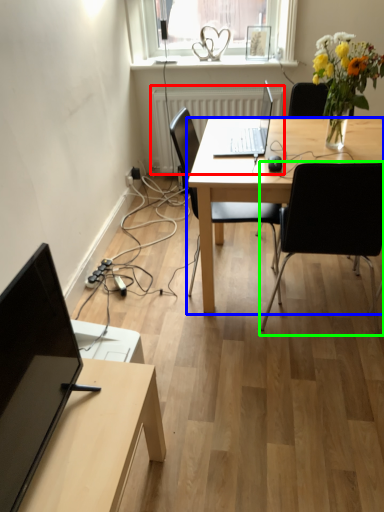
Question: Which object is positioned farthest from radiator (highlighted by a red box)? Select from desk (highlighted by a blue box) and chair (highlighted by a green box).

Choices:
 (A) desk
 (B) chair

Answer: (B)